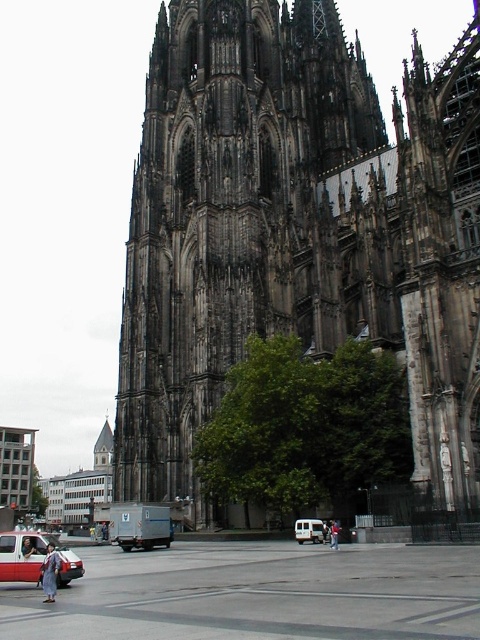
You are standing in front of the Cologne Cathedral and want to take a photo that includes both the point at coordinates point (417, 474) and point (296, 532). Which point will appear larger in your photo?

Point (417, 474) is closer to the viewer than point (296, 532), so it will appear larger in the photo.

You are standing in the square in front of the cathedral. You see two points marked on the ground. One is at point (79,570) and the other at point (317,541). If you are facing the cathedral, which point is closer to you?

Point (79,570) is in front of point (317,541), so if you are facing the cathedral, point (79,570) is closer to you.